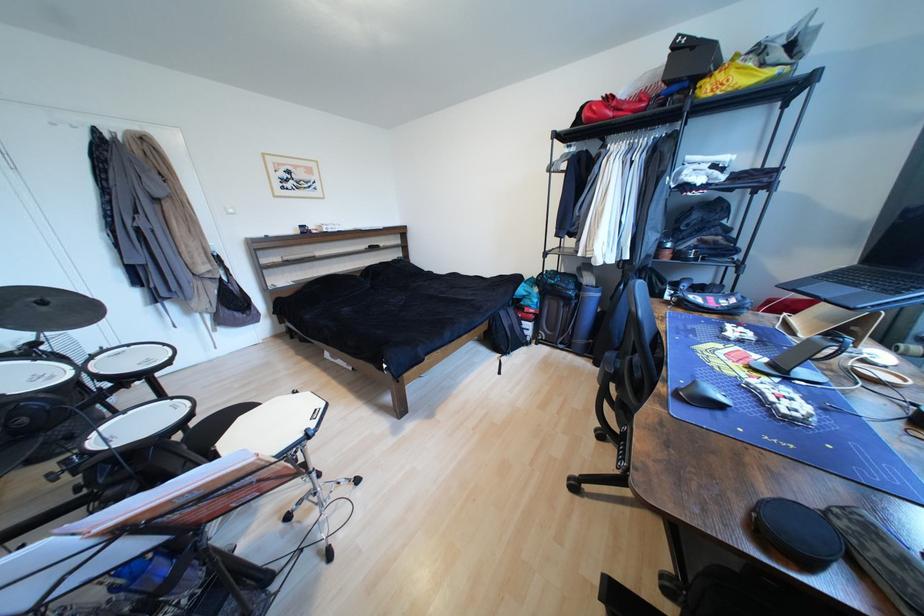
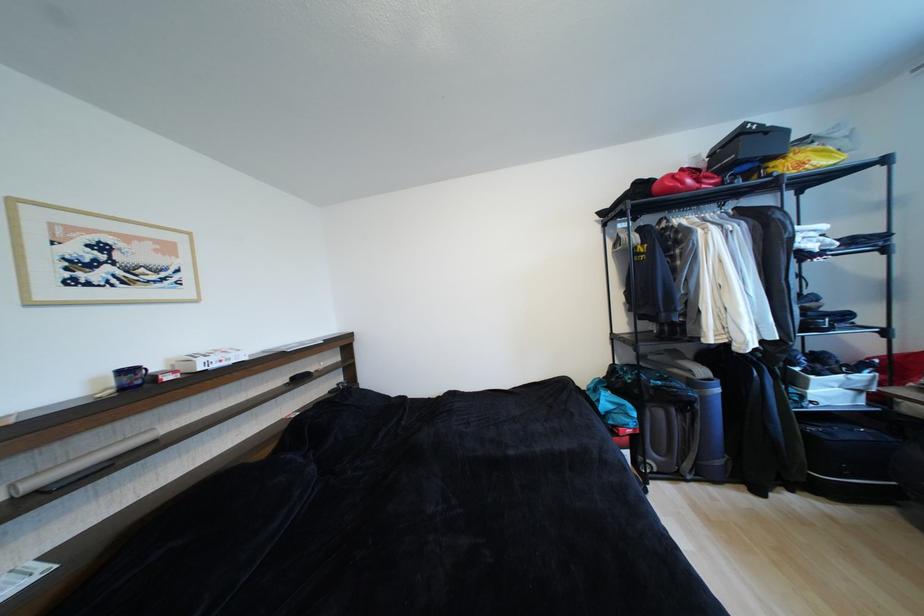
Locate, in the second image, the point that corresponds to [596,121] in the first image.

(676, 192)